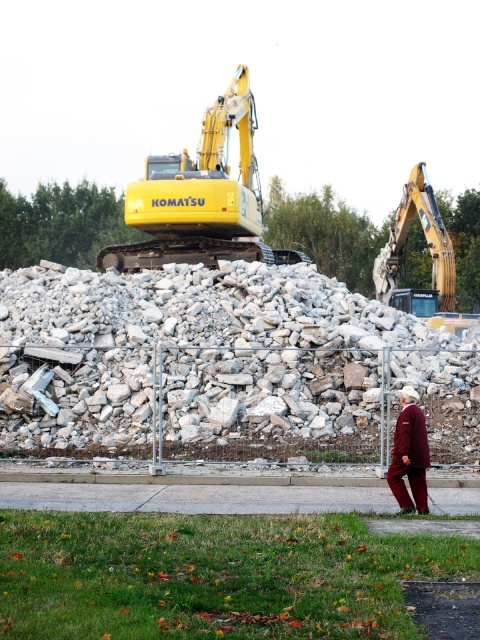
You are a construction worker standing at the edge of the construction site near the paved path. You need to move a heavy object from the grassy area to the excavator. Which direction should you head towards to reach the yellow metallic excavator at upper center?

The yellow metallic excavator at upper center is located at point [201,196], so you should head towards the upper center direction to reach it.

You are a surveyor using a coordinate system where lower numbers indicate closer proximity to the camera. You need to determine which of the two points, point (263, 349) or point (224, 200), is nearer to you. Which point is closer?

Point (263, 349) is closer to the camera than point (224, 200).